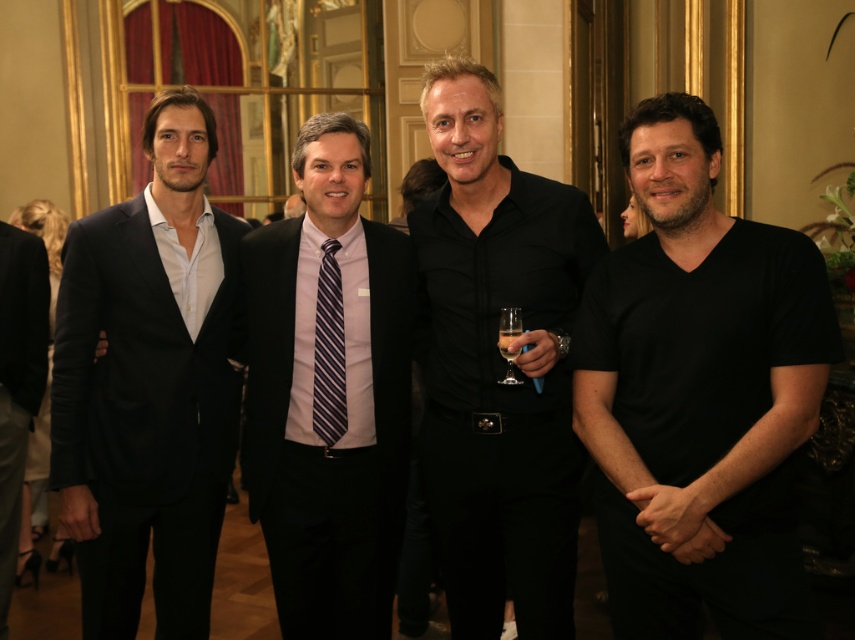
Can you confirm if matte black suit at center is smaller than black matte suit at left?

Incorrect, matte black suit at center is not smaller in size than black matte suit at left.

Measure the distance between point (351,474) and camera.

Point (351,474) and camera are 11.06 feet apart from each other.

Is point (310, 275) positioned after point (27, 276)?

No, it is in front of (27, 276).

The width and height of the screenshot is (855, 640). Identify the location of matte black suit at center. pos(329,392).

Is point (509, 588) positioned in front of point (331, 292)?

That is False.

Which is behind, point (516, 198) or point (337, 316)?

The point (337, 316) is more distant.

Describe the element at coordinates (497, 364) in the screenshot. I see `black smooth shirt at center` at that location.

The width and height of the screenshot is (855, 640). Identify the location of black smooth shirt at center. (497, 364).

Between blue striped tie at center and clear glass at center, which one has less height?

clear glass at center

Identify the location of blue striped tie at center. (328, 349).